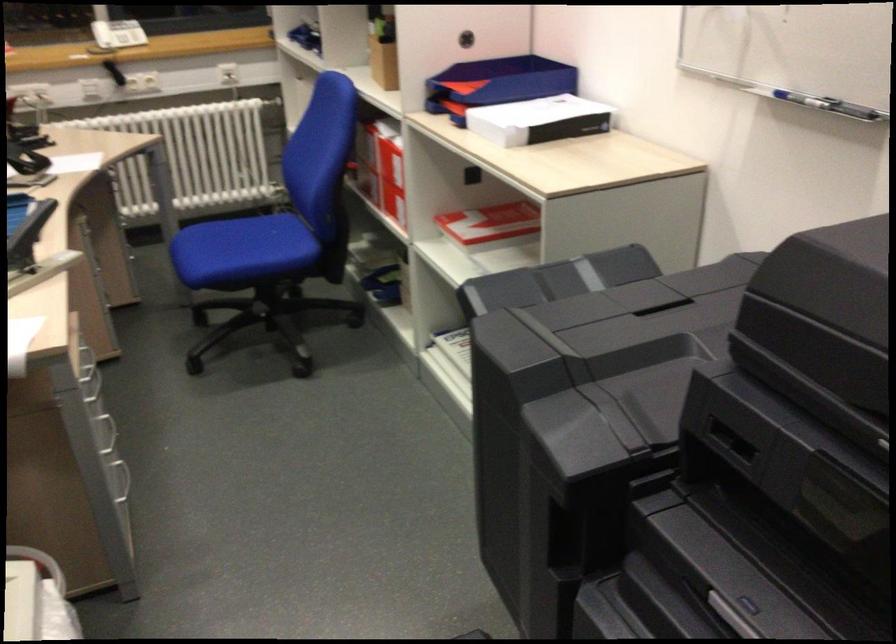
At what (x,y) coordinates should I click in order to perform the action: click on blue chair sitting surface. Please return your answer as a coordinate pair (x, y). Looking at the image, I should click on (254, 241).